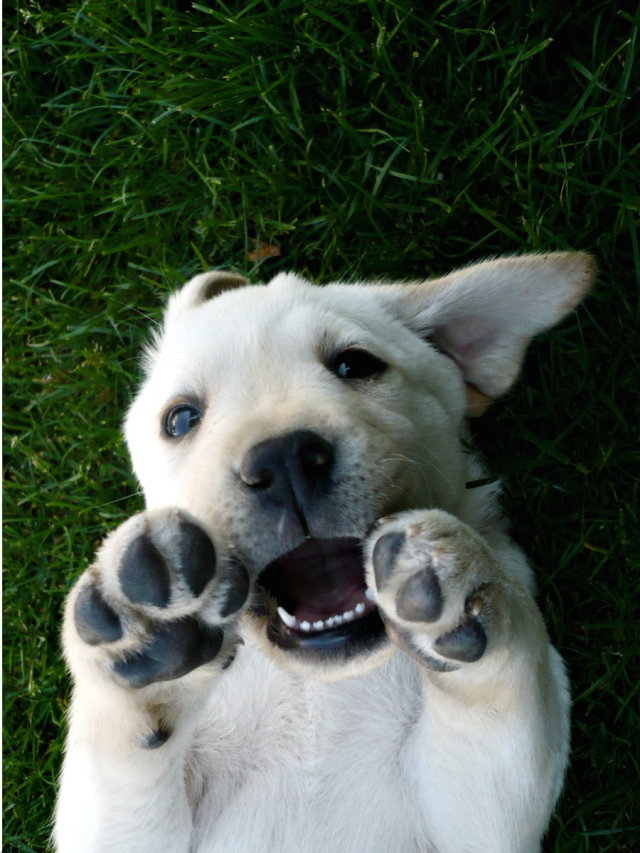
In order to click on white fur in this screenshot , I will do `click(454, 785)`.